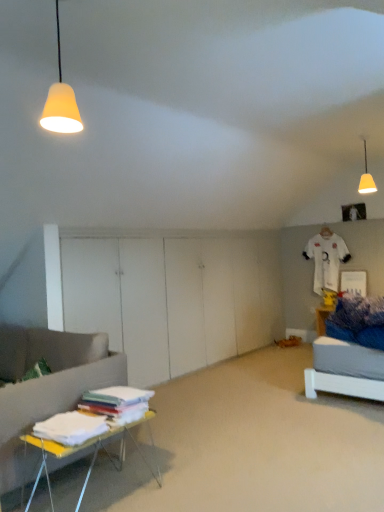
Where is `vacant region above matte yellow lampshade at upper right, the second lamp viewed from the front (from a real-world perspective)`? This screenshot has height=512, width=384. vacant region above matte yellow lampshade at upper right, the second lamp viewed from the front (from a real-world perspective) is located at coordinates (373, 134).